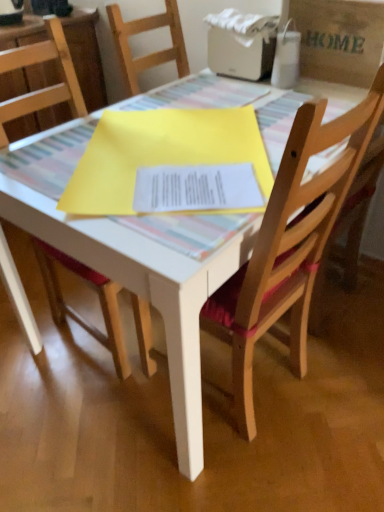
Question: Does white plastic printer at upper center have a lesser width compared to brown paper bag at upper right?

Choices:
 (A) no
 (B) yes

Answer: (A)

Question: Is white plastic printer at upper center facing towards brown paper bag at upper right?

Choices:
 (A) yes
 (B) no

Answer: (B)

Question: From the image's perspective, is white plastic printer at upper center on brown paper bag at upper right?

Choices:
 (A) yes
 (B) no

Answer: (A)

Question: Can brown paper bag at upper right be found inside white plastic printer at upper center?

Choices:
 (A) yes
 (B) no

Answer: (B)

Question: Is white plastic printer at upper center wider than brown paper bag at upper right?

Choices:
 (A) yes
 (B) no

Answer: (A)

Question: Based on their positions, is brown paper bag at upper right located to the left or right of white plastic printer at upper center?

Choices:
 (A) left
 (B) right

Answer: (B)

Question: Is brown paper bag at upper right spatially inside white plastic printer at upper center, or outside of it?

Choices:
 (A) outside
 (B) inside

Answer: (A)

Question: Considering the positions of brown paper bag at upper right and white plastic printer at upper center in the image, is brown paper bag at upper right bigger or smaller than white plastic printer at upper center?

Choices:
 (A) small
 (B) big

Answer: (A)

Question: In terms of width, does brown paper bag at upper right look wider or thinner when compared to white plastic printer at upper center?

Choices:
 (A) wide
 (B) thin

Answer: (B)

Question: From the image's perspective, relative to brown paper bag at upper right, is wooden chair with red cushion at center, the first chair from the right, above or below?

Choices:
 (A) below
 (B) above

Answer: (A)

Question: Considering the relative positions of wooden chair with red cushion at center, the first chair from the right, and brown paper bag at upper right in the image provided, is wooden chair with red cushion at center, the first chair from the right, to the left or to the right of brown paper bag at upper right?

Choices:
 (A) right
 (B) left

Answer: (B)

Question: Considering their positions, is wooden chair with red cushion at center, which is the 2th chair in left-to-right order, located in front of or behind brown paper bag at upper right?

Choices:
 (A) front
 (B) behind

Answer: (A)

Question: In terms of height, does wooden chair with red cushion at center, which is the 2th chair in left-to-right order, look taller or shorter compared to brown paper bag at upper right?

Choices:
 (A) short
 (B) tall

Answer: (B)

Question: Considering the positions of point (144, 358) and point (319, 65), is point (144, 358) closer or farther from the camera than point (319, 65)?

Choices:
 (A) farther
 (B) closer

Answer: (B)

Question: From a real-world perspective, is wooden chair at center, the first chair positioned from the left, physically located above or below brown paper bag at upper right?

Choices:
 (A) below
 (B) above

Answer: (A)